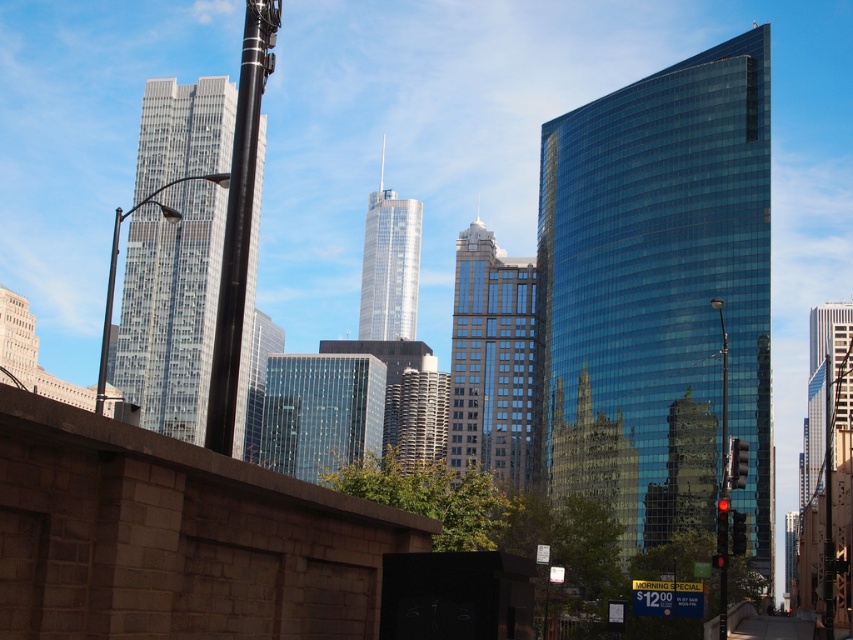
Question: Which object appears farthest from the camera in this image?

Choices:
 (A) glassy reflective skyscraper at center
 (B) metallic traffic light at right
 (C) silver glass skyscraper at center
 (D) glassy steel skyscraper at center-left

Answer: (C)

Question: Which point appears farthest from the camera in this image?

Choices:
 (A) click(x=364, y=422)
 (B) click(x=508, y=291)
 (C) click(x=403, y=225)
 (D) click(x=165, y=355)

Answer: (C)

Question: Can you confirm if glassy reflective skyscraper at center is positioned above silver glass skyscraper at center?

Choices:
 (A) no
 (B) yes

Answer: (A)

Question: Does silver glass skyscraper at center appear on the left side of metallic traffic light at right?

Choices:
 (A) yes
 (B) no

Answer: (A)

Question: Does glassy reflective skyscraper at center appear on the left side of metallic traffic light at right?

Choices:
 (A) yes
 (B) no

Answer: (A)

Question: Which object is farther from the camera taking this photo?

Choices:
 (A) glassy steel skyscraper at center-left
 (B) silver glass skyscraper at center
 (C) metallic traffic light at right

Answer: (B)